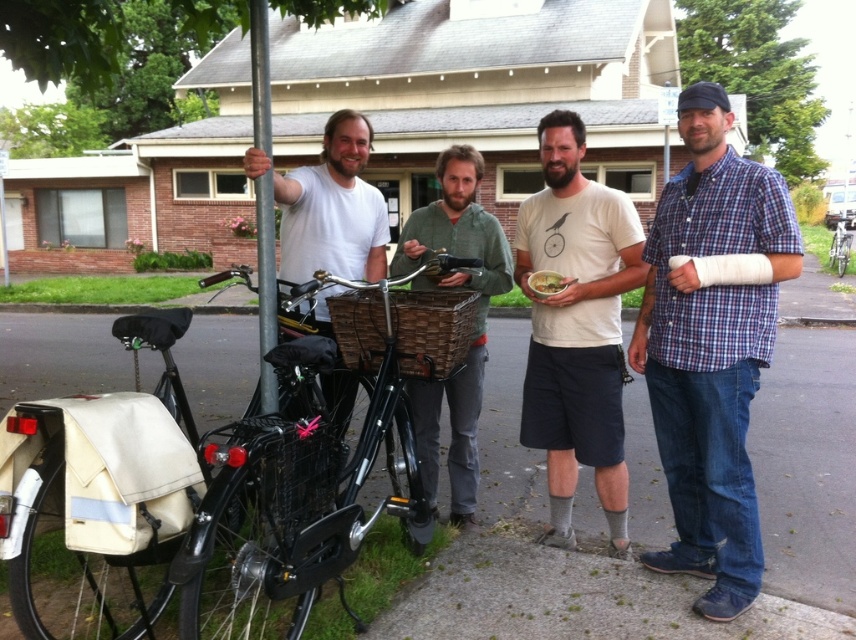
Question: Is white cotton t-shirt at center smaller than matte white t-shirt at left?

Choices:
 (A) no
 (B) yes

Answer: (A)

Question: Estimate the real-world distances between objects in this image. Which object is farther from the silver metallic bicycle at right?

Choices:
 (A) woven brown basket at center
 (B) smooth plastic bowl at center
 (C) white cotton t-shirt at center

Answer: (B)

Question: Which of the following is the closest to the observer?

Choices:
 (A) green woven basket at center
 (B) matte white t-shirt at left
 (C) black matte bicycle at left
 (D) blue plaid shirt at right

Answer: (C)

Question: Is green woven basket at center below smooth plastic bowl at center?

Choices:
 (A) yes
 (B) no

Answer: (A)

Question: Can you confirm if blue plaid shirt at right is positioned to the right of smooth plastic bowl at center?

Choices:
 (A) no
 (B) yes

Answer: (B)

Question: Which of the following is the farthest from the observer?

Choices:
 (A) matte white t-shirt at left
 (B) silver metallic bicycle at right
 (C) black matte bicycle at left
 (D) white cotton t-shirt at center

Answer: (B)